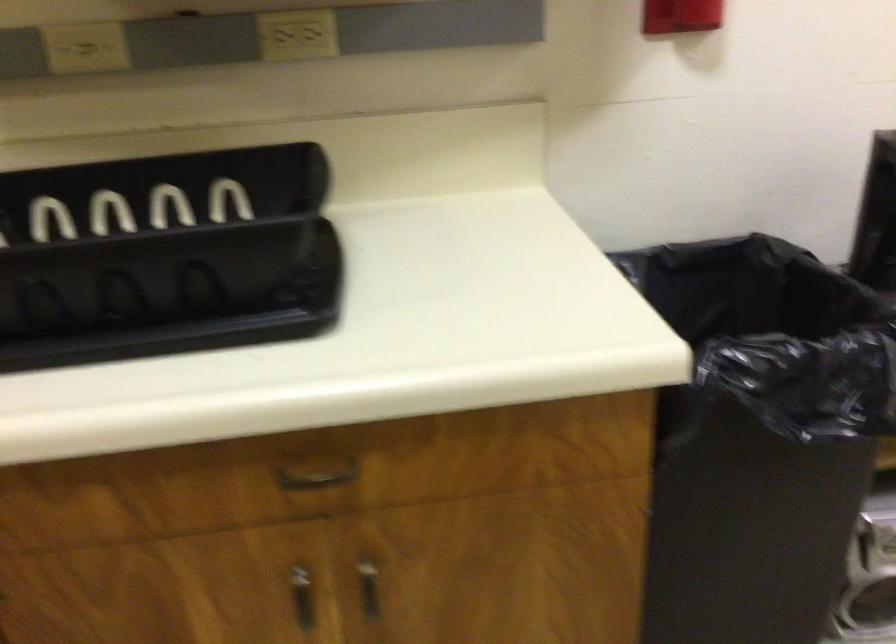
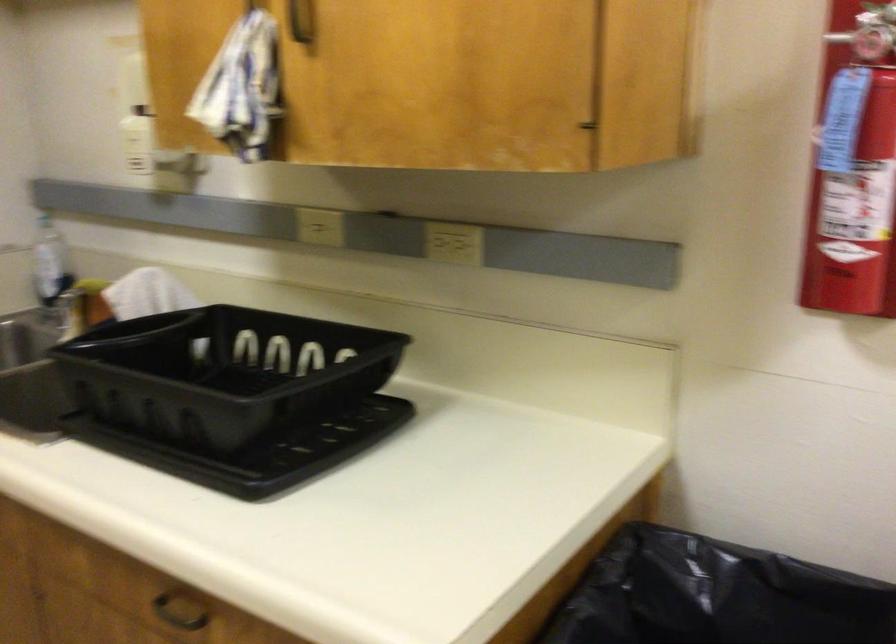
In the second image, find the point that corresponds to point 289,478 in the first image.

(178, 611)